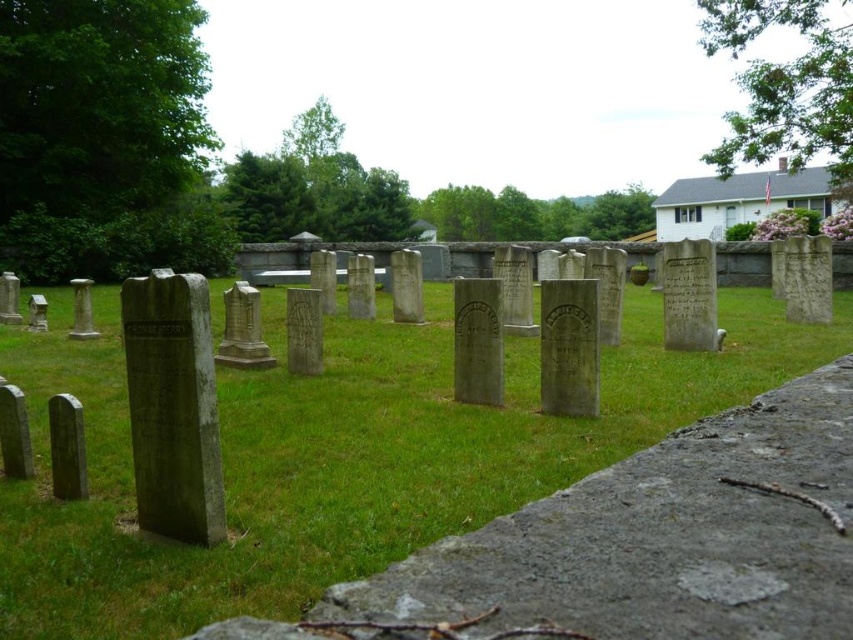
Question: Where is gray stone gravestone at left located in relation to smooth gray stone at lower left in the image?

Choices:
 (A) right
 (B) left

Answer: (A)

Question: Which object appears farthest from the camera in this image?

Choices:
 (A) green grass at center
 (B) gray stone gravestone at left

Answer: (B)

Question: Can you confirm if gray stone gravestone at left is thinner than smooth gray stone at lower left?

Choices:
 (A) no
 (B) yes

Answer: (A)

Question: Which point is closer to the camera taking this photo?

Choices:
 (A) (224, 582)
 (B) (80, 492)
 (C) (38, 298)

Answer: (A)

Question: Which point is farther to the camera?

Choices:
 (A) (170, 428)
 (B) (77, 445)

Answer: (B)

Question: From the image, what is the correct spatial relationship of green grass at center in relation to smooth gray stone gravestone at left?

Choices:
 (A) above
 (B) below

Answer: (B)